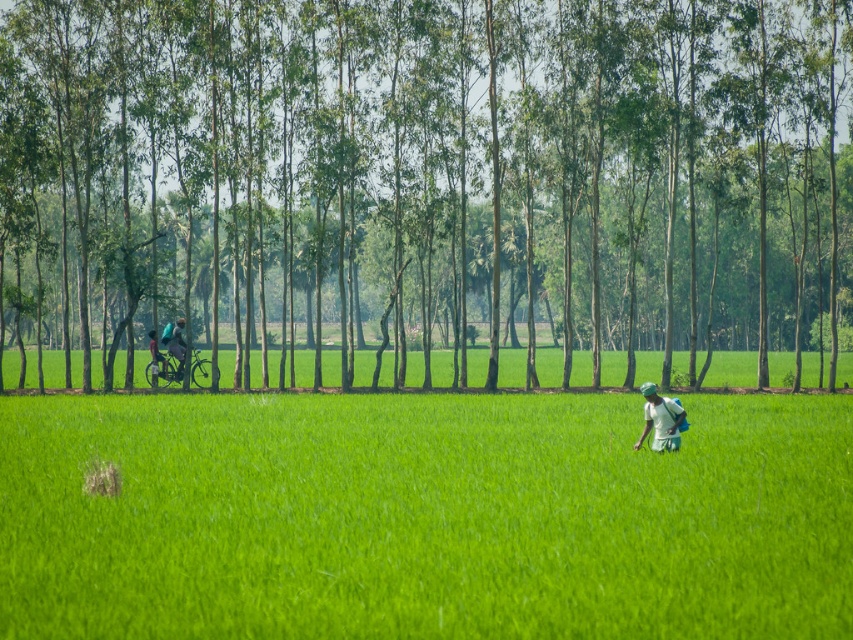
You are a farmer who needs to place a dark blue fabric at left to cover the dark blue fabric bicycle at left. Based on the scene, will the fabric be large enough to cover the bicycle?

The dark blue fabric bicycle at left has a greater height compared to the dark blue fabric at left, so the fabric will not be large enough to cover the bicycle.

You are standing in the rural landscape and want to place a picnic blanket. The dark blue fabric bicycle at left is in your way. Can you move the bicycle to the right side of the field without crossing the line of tall, slender trees in the midground?

The dark blue fabric bicycle at left is located at point (175, 342). Since the trees form a natural border between the field and the background, moving the bicycle to the right side of the field would require placing it within the field area before the trees. Therefore, you can move the bicycle to the right side of the field without crossing the line of tall, slender trees in the midground.

You are a hiker who wants to take a photo of the white fabric shirt at lower right and the dark blue fabric bicycle at left. Which object should you focus on first if you want both to be in sharp focus?

The white fabric shirt at lower right is positioned under the dark blue fabric bicycle at left, so you should focus on the dark blue fabric bicycle at left first to ensure both are in focus.